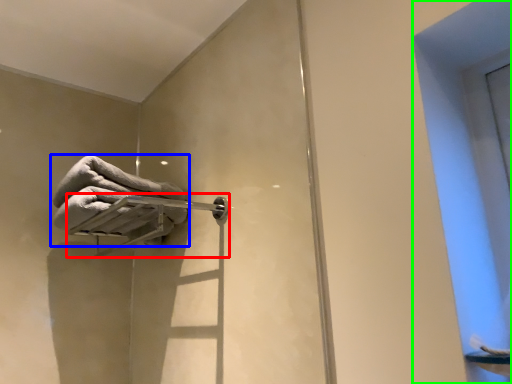
Question: Based on their relative distances, which object is farther from towel bar (highlighted by a red box)? Choose from towel (highlighted by a blue box) and window (highlighted by a green box).

Choices:
 (A) towel
 (B) window

Answer: (B)